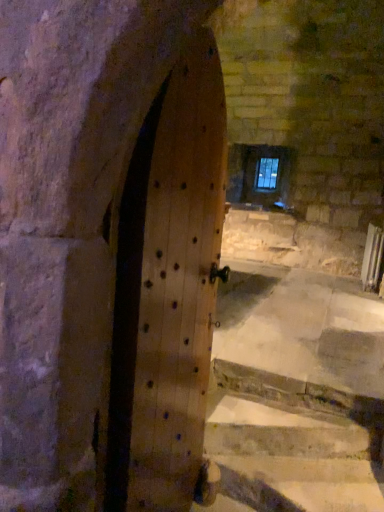
Question: Is clear glass window at upper center in front of or behind natural wood door at center in the image?

Choices:
 (A) behind
 (B) front

Answer: (A)

Question: Is clear glass window at upper center taller or shorter than natural wood door at center?

Choices:
 (A) short
 (B) tall

Answer: (A)

Question: Which is correct: clear glass window at upper center is inside natural wood door at center, or outside of it?

Choices:
 (A) inside
 (B) outside

Answer: (B)

Question: From the image's perspective, is natural wood door at center positioned above or below clear glass window at upper center?

Choices:
 (A) above
 (B) below

Answer: (B)

Question: In the image, is natural wood door at center on the left side or the right side of clear glass window at upper center?

Choices:
 (A) left
 (B) right

Answer: (A)

Question: Considering their positions, is natural wood door at center located in front of or behind clear glass window at upper center?

Choices:
 (A) front
 (B) behind

Answer: (A)

Question: Would you say natural wood door at center is inside or outside clear glass window at upper center?

Choices:
 (A) inside
 (B) outside

Answer: (B)